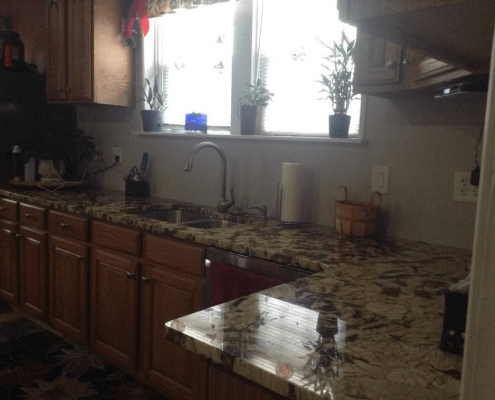
Image resolution: width=495 pixels, height=400 pixels. In order to click on knob in this screenshot , I will do `click(64, 91)`, `click(127, 276)`, `click(141, 278)`, `click(391, 65)`, `click(403, 63)`.